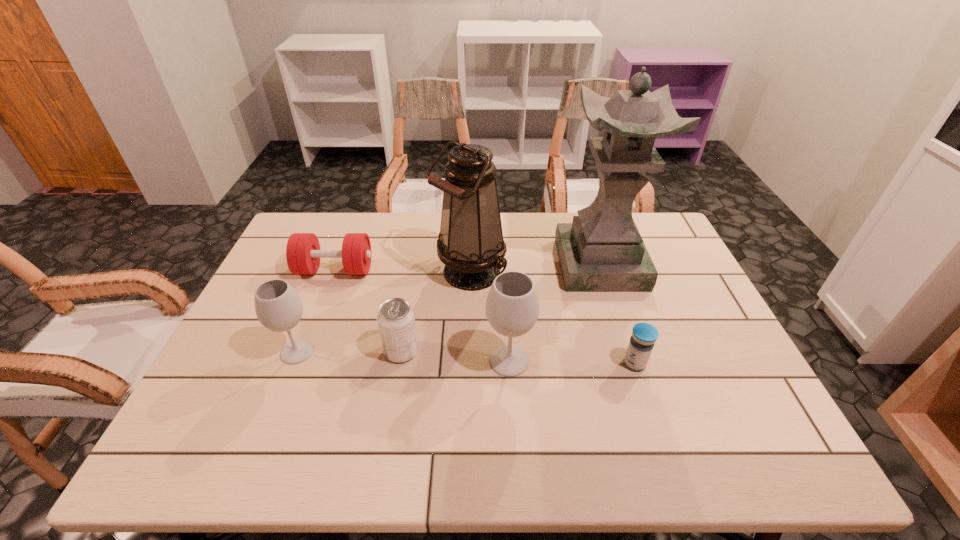
This screenshot has height=540, width=960. Find the location of `the shorter wineglass`. the shorter wineglass is located at coordinates (278, 307).

What are the coordinates of `the left wineglass` in the screenshot? It's located at (278, 307).

Locate an element on the screen. The width and height of the screenshot is (960, 540). the right wineglass is located at coordinates (512, 307).

I want to click on the taller wineglass, so click(x=512, y=307).

The width and height of the screenshot is (960, 540). I want to click on dumbbell, so click(x=303, y=254).

This screenshot has width=960, height=540. Find the location of `the tallest object`. the tallest object is located at coordinates (602, 250).

I want to click on the sixth shortest object, so click(470, 243).

Locate an element on the screen. This screenshot has height=540, width=960. the fifth tallest object is located at coordinates (396, 321).

At what (x,y) coordinates should I click in order to perform the action: click on soda can. Please return your answer as a coordinate pair (x, y). This screenshot has width=960, height=540. Looking at the image, I should click on (396, 321).

You are a GUI agent. You are given a task and a screenshot of the screen. Output one action in this format:
    pyautogui.click(x=<x>, y=<y>)
    Task: Click on the medicine
    The height and width of the screenshot is (540, 960).
    Given the screenshot: What is the action you would take?
    [644, 335]